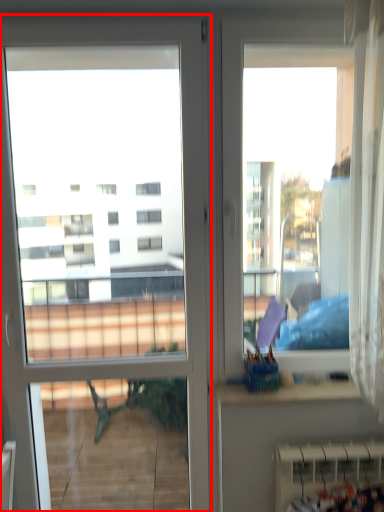
Question: Where is door (annotated by the red box) located in relation to radiator in the image?

Choices:
 (A) right
 (B) left

Answer: (B)